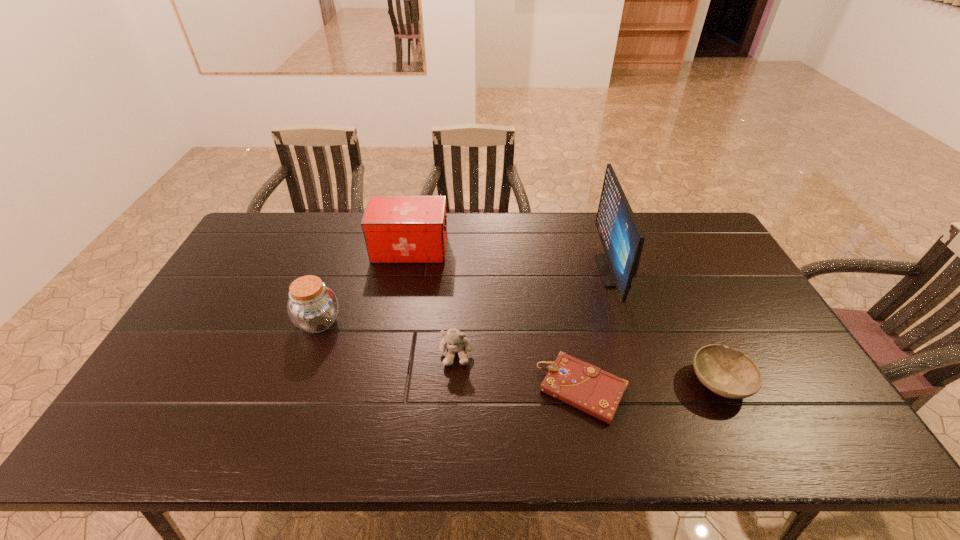
The height and width of the screenshot is (540, 960). In order to click on free space between the third object from left to right and the jar in this screenshot , I will do `click(387, 338)`.

You are a GUI agent. You are given a task and a screenshot of the screen. Output one action in this format:
    pyautogui.click(x=<x>, y=<y>)
    Task: Click on the unoccupied position between the third object from right to left and the computer monitor
    
    Given the screenshot: What is the action you would take?
    pyautogui.click(x=598, y=330)

I want to click on vacant area that lies between the shortest object and the tallest object, so click(x=598, y=330).

At what (x,y) coordinates should I click in order to perform the action: click on free space between the jar and the third object from left to right. Please return your answer as a coordinate pair (x, y). This screenshot has width=960, height=540. Looking at the image, I should click on (387, 338).

Where is `free point between the third object from right to left and the first-aid kit`? free point between the third object from right to left and the first-aid kit is located at coordinates (496, 319).

Locate an element on the screen. The height and width of the screenshot is (540, 960). free space that is in between the third shortest object and the leftmost object is located at coordinates (387, 338).

Identify the location of empty location between the tallest object and the first-aid kit. (512, 260).

Where is `object that is the third nearest to the fourth object from left to right`? object that is the third nearest to the fourth object from left to right is located at coordinates (456, 342).

The height and width of the screenshot is (540, 960). I want to click on the closest object to the second object from right to left, so click(582, 385).

I want to click on blank space that satisfies the following two spatial constraints: 1. on the screen side of the computer monitor; 2. on the face of the third shortest object, so (640, 354).